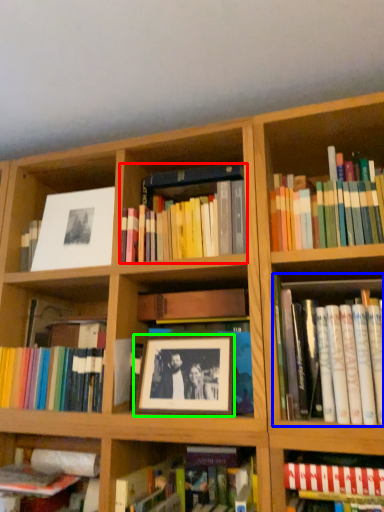
Question: Which object is positioned closest to book (highlighted by a red box)? Select from book (highlighted by a blue box) and picture frame (highlighted by a green box).

Choices:
 (A) book
 (B) picture frame

Answer: (B)